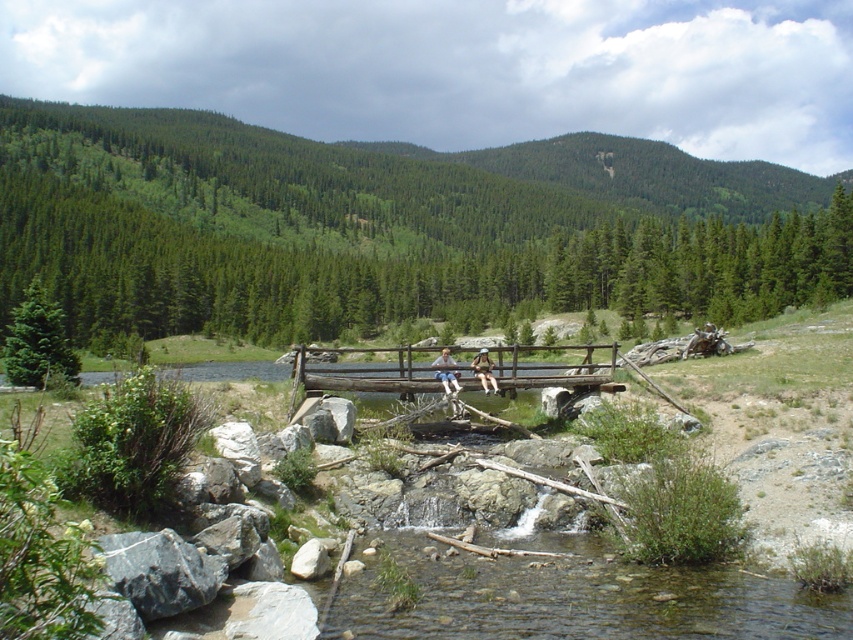
Question: Which of these objects is positioned closest to the brown wooden bridge at center?

Choices:
 (A) matte black shorts at center
 (B) light brown wooden bench at center
 (C) clear water at center

Answer: (B)

Question: Which object is positioned closest to the clear water at center?

Choices:
 (A) brown wooden bridge at center
 (B) light brown wooden bench at center

Answer: (B)

Question: Which object appears closest to the camera in this image?

Choices:
 (A) matte black shorts at center
 (B) brown wooden bridge at center

Answer: (B)

Question: Can you confirm if matte black shorts at center is smaller than light brown wooden bench at center?

Choices:
 (A) yes
 (B) no

Answer: (A)

Question: Is matte black shorts at center bigger than light brown wooden bench at center?

Choices:
 (A) yes
 (B) no

Answer: (B)

Question: From the image, what is the correct spatial relationship of clear water at center in relation to light brown wooden bench at center?

Choices:
 (A) right
 (B) left

Answer: (B)